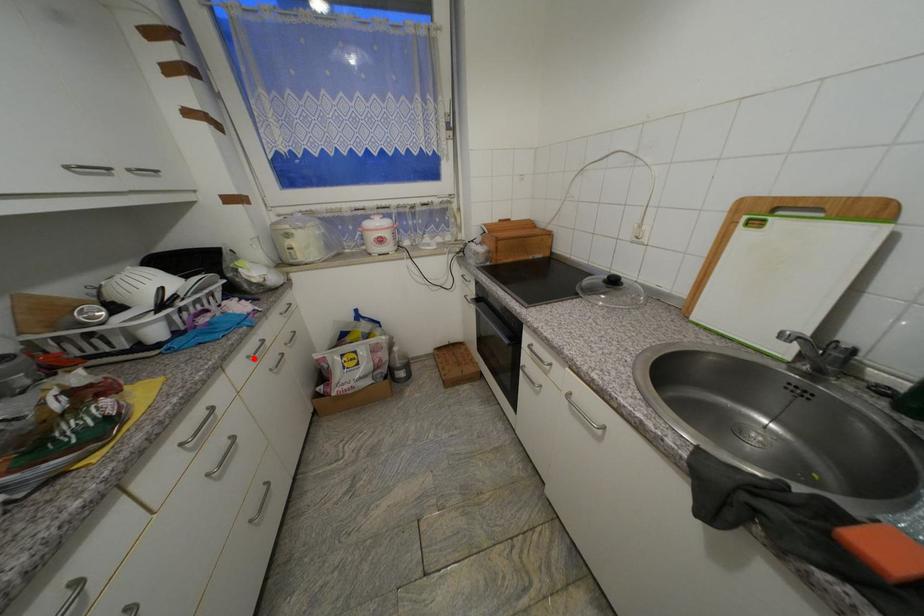
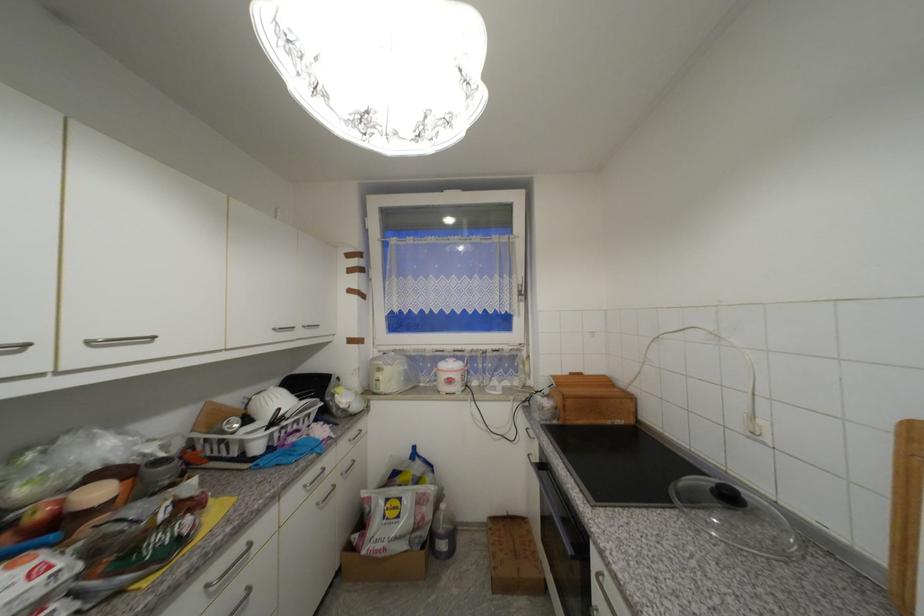
Question: I am providing you with two images of the same scene from different viewpoints. Given a red point in image1, look at the same physical point in image2. Is it:

Choices:
 (A) Closer to the viewpoint
 (B) Farther from the viewpoint

Answer: (B)